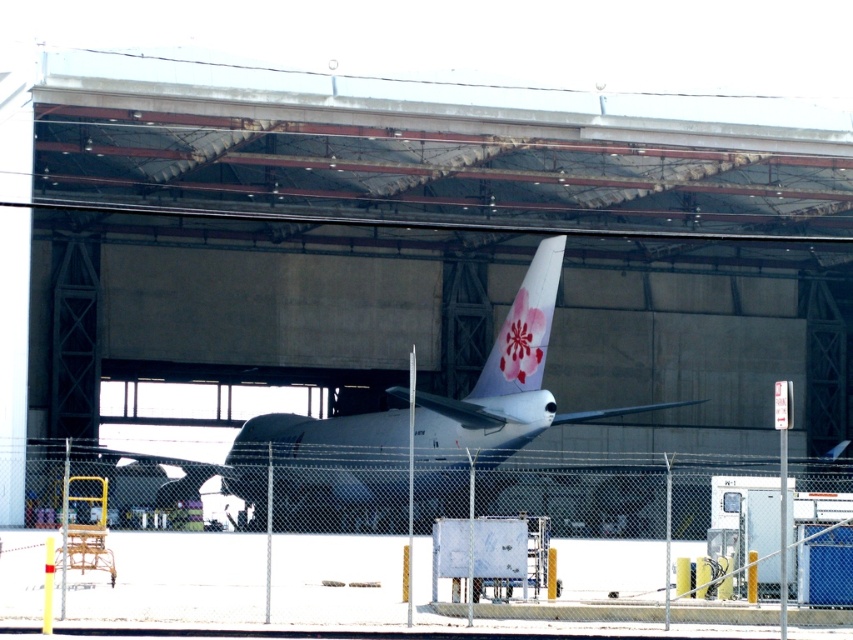
Image resolution: width=853 pixels, height=640 pixels. Find the location of `chain-link fence at center`. chain-link fence at center is located at coordinates (271, 560).

Does point (744, 618) lie behind point (287, 481)?

No, (744, 618) is closer to viewer.

Locate an element on the screen. The image size is (853, 640). chain-link fence at center is located at coordinates (271, 560).

Locate an element on the screen. This screenshot has height=640, width=853. chain-link fence at center is located at coordinates (271, 560).